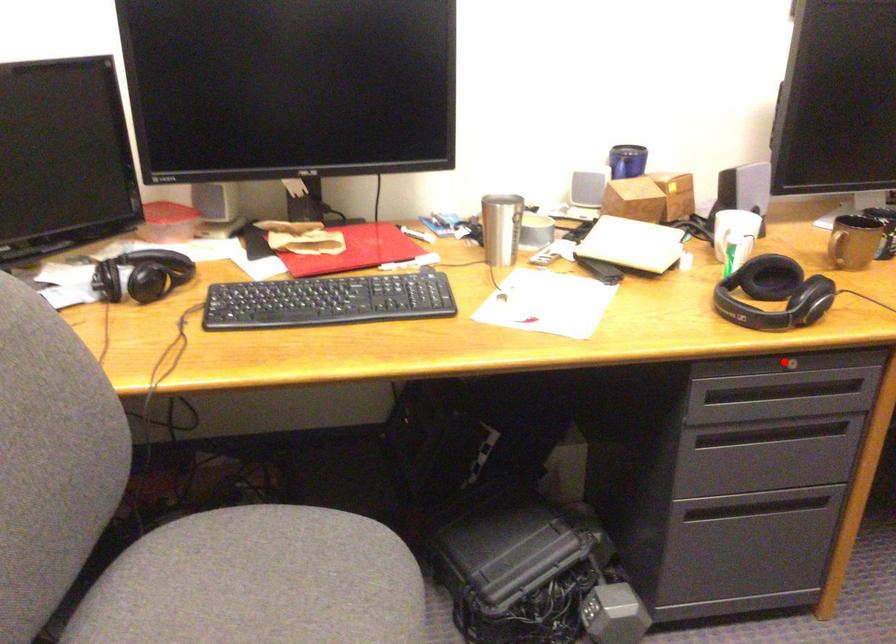
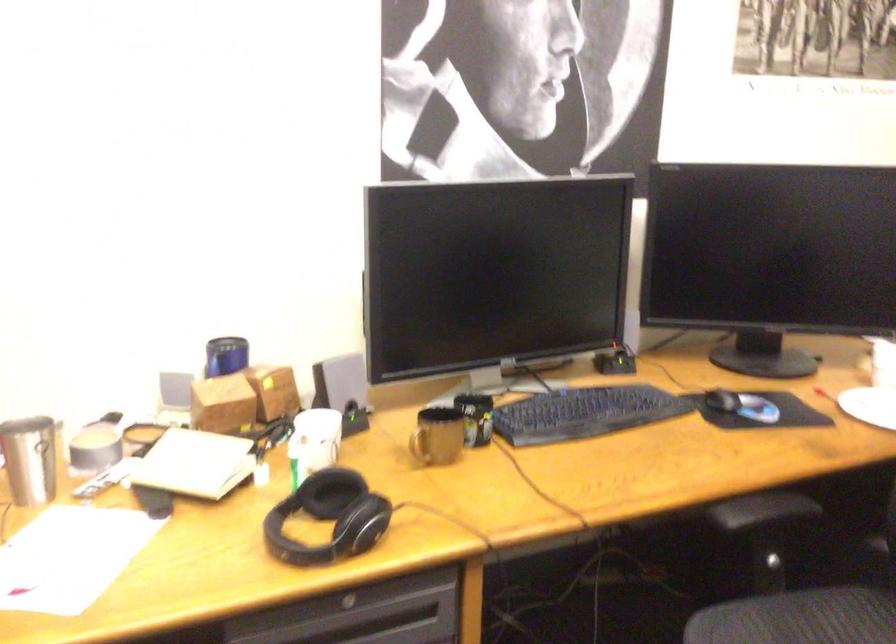
The point at the highlighted location is marked in the first image. Where is the corresponding point in the second image?

(347, 603)